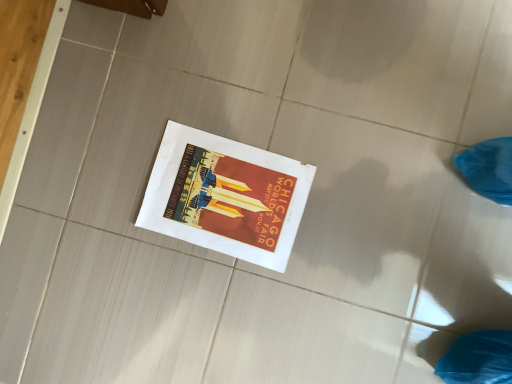
The width and height of the screenshot is (512, 384). I want to click on vacant space in white paper poster at center (from a real-world perspective), so click(233, 212).